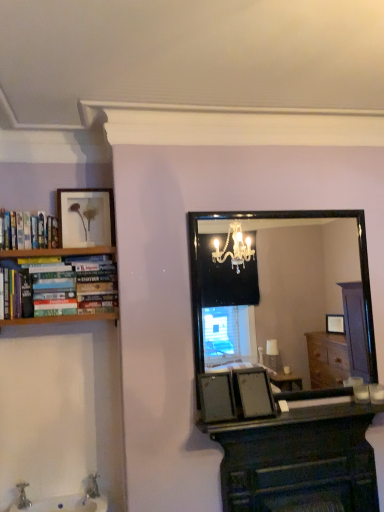
The height and width of the screenshot is (512, 384). In order to click on dark wood computer desk at center in this screenshot , I will do `click(299, 460)`.

The width and height of the screenshot is (384, 512). What are the coordinates of `black glass mirror at center` in the screenshot? It's located at (274, 287).

Identify the location of white glossy sink at lower left. (67, 504).

Is hardcover books at left positioned far away from white glossy sink at lower left?

That's right, there is a large distance between hardcover books at left and white glossy sink at lower left.

Considering the relative positions of hardcover books at left and white glossy sink at lower left in the image provided, is hardcover books at left to the left of white glossy sink at lower left from the viewer's perspective?

Correct, you'll find hardcover books at left to the left of white glossy sink at lower left.

The height and width of the screenshot is (512, 384). Identify the location of sink on the right of hardcover books at left. (67, 504).

Is matte gold picture frame at upper left surrounding dark wood computer desk at center?

No, dark wood computer desk at center is not inside matte gold picture frame at upper left.

Who is smaller, matte gold picture frame at upper left or dark wood computer desk at center?

Smaller between the two is matte gold picture frame at upper left.

Considering the sizes of objects matte gold picture frame at upper left and dark wood computer desk at center in the image provided, who is taller, matte gold picture frame at upper left or dark wood computer desk at center?

Standing taller between the two is dark wood computer desk at center.

Is point (99, 240) closer or farther from the camera than point (223, 500)?

Point (99, 240).

How many degrees apart are the facing directions of hardcover books at left and smooth black countertop at lower center?

The facing directions of hardcover books at left and smooth black countertop at lower center are 0.332 degrees apart.

Between hardcover books at left and smooth black countertop at lower center, which one appears on the right side from the viewer's perspective?

smooth black countertop at lower center.

Who is bigger, hardcover books at left or smooth black countertop at lower center?

smooth black countertop at lower center.

Does hardcover books at left have a greater width compared to smooth black countertop at lower center?

No, hardcover books at left is not wider than smooth black countertop at lower center.

Between point (73, 498) and point (223, 472), which one is positioned in front?

The point (223, 472) is more forward.

Who is taller, white glossy sink at lower left or dark wood computer desk at center?

dark wood computer desk at center is taller.

From a real-world perspective, is white glossy sink at lower left on top of dark wood computer desk at center?

No, from a real-world perspective, white glossy sink at lower left is not over dark wood computer desk at center

Which of these two, white glossy sink at lower left or dark wood computer desk at center, is thinner?

With smaller width is dark wood computer desk at center.

Can you tell me how much white glossy sink at lower left and smooth black countertop at lower center differ in facing direction?

They differ by 1.55 degrees in their facing directions.

Between point (76, 498) and point (339, 406), which one is positioned behind?

Point (76, 498)

From the image's perspective, which is below, white glossy sink at lower left or smooth black countertop at lower center?

white glossy sink at lower left.

Based on their sizes in the image, would you say white glossy sink at lower left is bigger or smaller than smooth black countertop at lower center?

In the image, white glossy sink at lower left appears to be larger than smooth black countertop at lower center.

There is a dark wood computer desk at center. What are the coordinates of `book above it (from a real-world perspective)` in the screenshot? It's located at (43, 231).

In the scene shown: Measure the distance between hardcover books at left and dark wood computer desk at center.

hardcover books at left and dark wood computer desk at center are 1.49 meters apart from each other.

Is hardcover books at left not near dark wood computer desk at center?

Absolutely, hardcover books at left is distant from dark wood computer desk at center.

Is point (19, 224) positioned in front of point (327, 452)?

No, it is behind (327, 452).

Can you tell me how much black glass mirror at center and matte gold picture frame at upper left differ in facing direction?

They differ by 1.64 degrees in their facing directions.

This screenshot has height=512, width=384. Identify the location of picture frame above the black glass mirror at center (from a real-world perspective). (86, 217).

Can you confirm if black glass mirror at center is taller than matte gold picture frame at upper left?

Yes.

Consider the image. From a real-world perspective, is black glass mirror at center positioned under matte gold picture frame at upper left based on gravity?

Indeed, from a real-world perspective, black glass mirror at center is positioned beneath matte gold picture frame at upper left.

Image resolution: width=384 pixels, height=512 pixels. I want to click on book above the white glossy sink at lower left (from a real-world perspective), so click(43, 231).

The height and width of the screenshot is (512, 384). Find the location of `picture frame that appears behind the dark wood computer desk at center`. picture frame that appears behind the dark wood computer desk at center is located at coordinates (86, 217).

Estimate the real-world distances between objects in this image. Which object is closer to black glass mirror at center, dark wood computer desk at center or hardcover books at left?

dark wood computer desk at center.

Based on their spatial positions, is hardcover books at left or white glossy sink at lower left further from matte gold picture frame at upper left?

white glossy sink at lower left is positioned further to the anchor matte gold picture frame at upper left.

Which object lies further to the anchor point smooth black countertop at lower center, matte gold picture frame at upper left or dark wood computer desk at center?

matte gold picture frame at upper left.

Based on their spatial positions, is smooth black countertop at lower center or hardcover books at left further from black glass mirror at center?

Based on the image, hardcover books at left appears to be further to black glass mirror at center.

When comparing their distances from black glass mirror at center, does smooth black countertop at lower center or white glossy sink at lower left seem further?

The object further to black glass mirror at center is white glossy sink at lower left.

Estimate the real-world distances between objects in this image. Which object is further from dark wood computer desk at center, black glass mirror at center or hardcover books at left?

black glass mirror at center is positioned further to the anchor dark wood computer desk at center.

When comparing their distances from white glossy sink at lower left, does black glass mirror at center or hardcover books at left seem closer?

hardcover books at left lies closer to white glossy sink at lower left than the other object.

Which object lies further to the anchor point matte gold picture frame at upper left, black glass mirror at center or smooth black countertop at lower center?

Among the two, black glass mirror at center is located further to matte gold picture frame at upper left.

I want to click on picture frame located between hardcover books at left and smooth black countertop at lower center in the left-right direction, so click(x=86, y=217).

You are a GUI agent. You are given a task and a screenshot of the screen. Output one action in this format:
    pyautogui.click(x=<x>, y=<y>)
    Task: Click on the sink between hardcover books at left and smooth black countertop at lower center
    
    Given the screenshot: What is the action you would take?
    pyautogui.click(x=67, y=504)

The width and height of the screenshot is (384, 512). What are the coordinates of `mirror between matte gold picture frame at upper left and smooth black countertop at lower center in the horizontal direction` in the screenshot? It's located at click(274, 287).

This screenshot has height=512, width=384. Find the location of `picture frame located between hardcover books at left and dark wood computer desk at center in the left-right direction`. picture frame located between hardcover books at left and dark wood computer desk at center in the left-right direction is located at coordinates (86, 217).